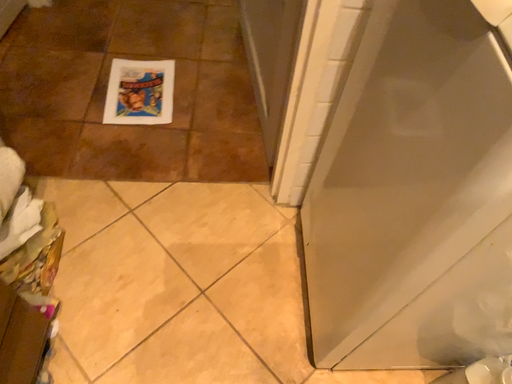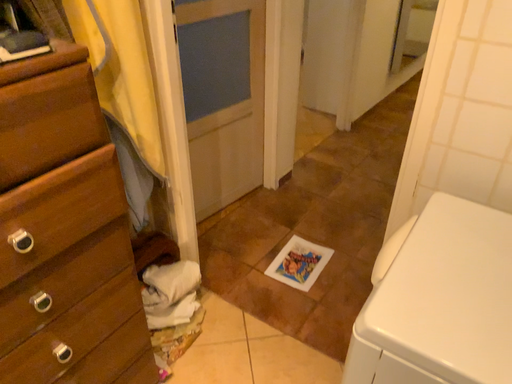
Question: Which way did the camera rotate in the video?

Choices:
 (A) rotated right
 (B) rotated left

Answer: (B)